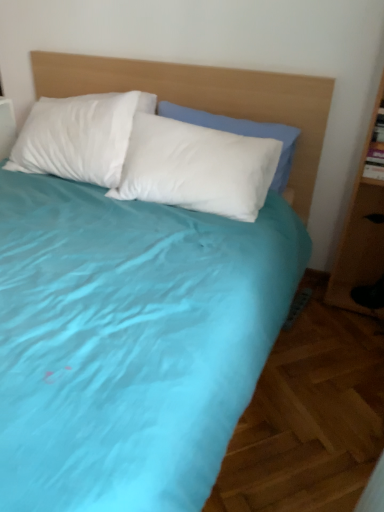
Question: Which is correct: white soft pillow at center is inside wooden headboard at upper center, or outside of it?

Choices:
 (A) outside
 (B) inside

Answer: (B)

Question: Looking at the image, does white soft pillow at center seem bigger or smaller compared to wooden headboard at upper center?

Choices:
 (A) small
 (B) big

Answer: (A)

Question: From a real-world perspective, relative to wooden headboard at upper center, is white soft pillow at center vertically above or below?

Choices:
 (A) below
 (B) above

Answer: (B)

Question: Do you think wooden headboard at upper center is within white soft pillow at center, or outside of it?

Choices:
 (A) outside
 (B) inside

Answer: (A)

Question: Considering their positions, is wooden headboard at upper center located in front of or behind white soft pillow at center?

Choices:
 (A) behind
 (B) front

Answer: (B)

Question: From a real-world perspective, is wooden headboard at upper center physically located above or below white soft pillow at center?

Choices:
 (A) above
 (B) below

Answer: (B)

Question: From the image's perspective, is wooden headboard at upper center positioned above or below white soft pillow at center?

Choices:
 (A) above
 (B) below

Answer: (B)